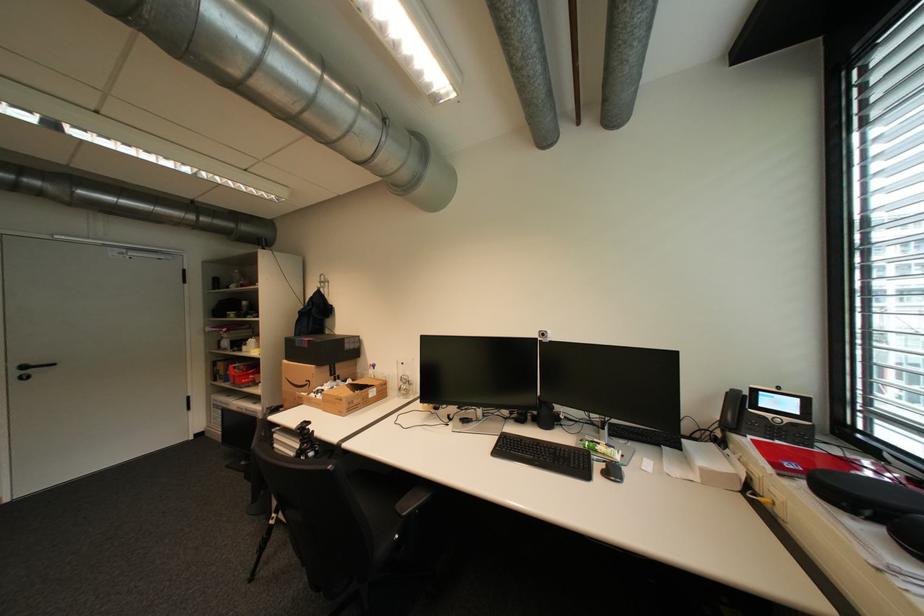
Where is `red box`? The image size is (924, 616). red box is located at coordinates (310, 378).